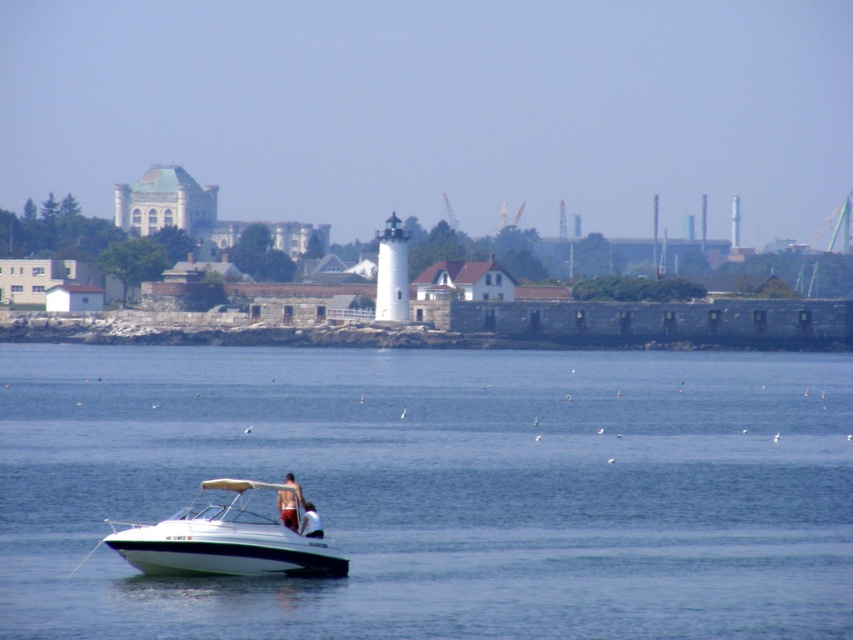
You are a drone operator trying to capture a photo of the white glossy boat at lower left. The drone is currently hovering at point (227, 540). Is the drone directly above the boat?

Yes, the drone is directly above the white glossy boat at lower left because the point (227, 540) is where the boat is located.

You are a drone operator trying to capture the white glossy boat at lower left from above. The drone has a maximum flight range of 100 meters. Given that the lighthouse is 150 meters away from your current position, can the drone reach the boat without exceeding its range?

The white glossy boat at lower left is located at point (227, 540). Since the lighthouse is 150 meters away and the boat is closer than the lighthouse, the drone can reach the boat within its 100 meter range.

You are navigating a small boat and need to reach the lighthouse in the distance. Your current position is marked by the point at coordinates point (x=438, y=490). According to the image, what is the direction you should head to reach the lighthouse?

The point (x=438, y=490) is on blue water at center. To reach the lighthouse, you should head north since the lighthouse is located north of the central blue water area.